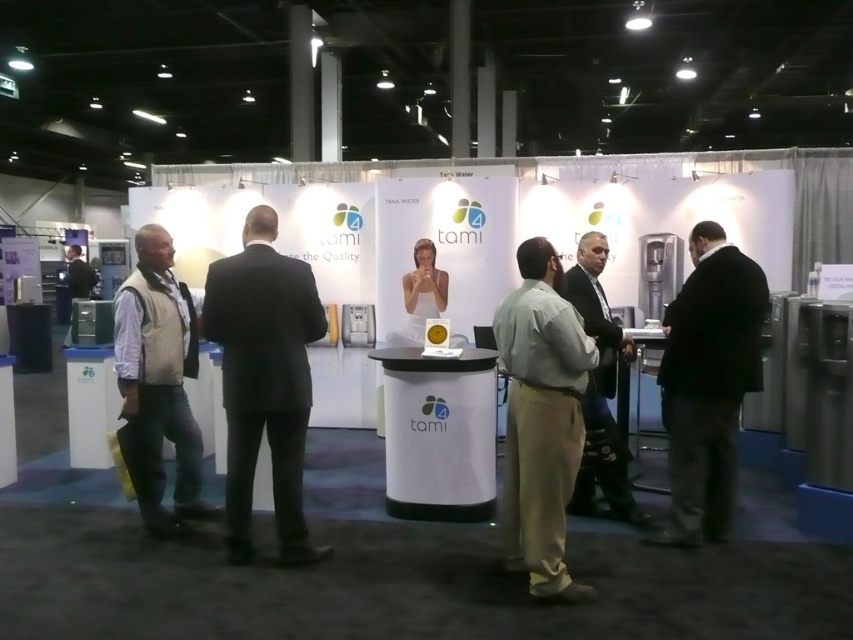
Between black wool suit at right and dark gray suit at center, which one is positioned higher?

dark gray suit at center is above.

Is black wool suit at right further to camera compared to dark gray suit at center?

No, it is not.

You are a GUI agent. You are given a task and a screenshot of the screen. Output one action in this format:
    pyautogui.click(x=<x>, y=<y>)
    Task: Click on the black wool suit at right
    
    Given the screenshot: What is the action you would take?
    pyautogui.click(x=708, y=381)

Image resolution: width=853 pixels, height=640 pixels. Find the location of `black wool suit at right`. black wool suit at right is located at coordinates (708, 381).

Is black suit at center smaller than light brown cotton pants at center?

Yes, black suit at center is smaller than light brown cotton pants at center.

Is black suit at center to the right of light brown cotton pants at center from the viewer's perspective?

No, black suit at center is not to the right of light brown cotton pants at center.

Which is in front, point (248, 285) or point (537, 269)?

Point (537, 269)

Locate an element on the screen. The height and width of the screenshot is (640, 853). black suit at center is located at coordinates (264, 380).

Can you confirm if light brown cotton pants at center is smaller than black wool suit at right?

No.

Based on the photo, who is more distant from viewer, (x=534, y=308) or (x=703, y=499)?

The point (x=703, y=499) is more distant.

This screenshot has height=640, width=853. I want to click on light brown cotton pants at center, so click(x=541, y=419).

Locate an element on the screen. The height and width of the screenshot is (640, 853). light brown cotton pants at center is located at coordinates (541, 419).